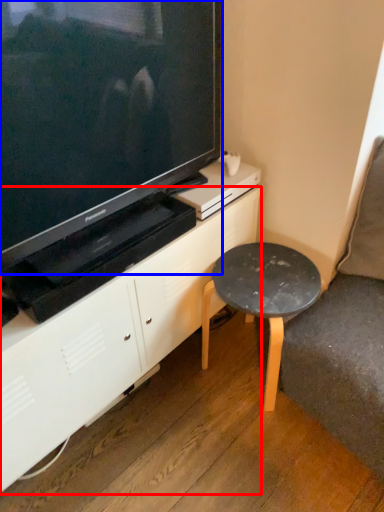
Question: Which point is further to the camera, cabinetry (highlighted by a red box) or television (highlighted by a blue box)?

Choices:
 (A) cabinetry
 (B) television

Answer: (A)